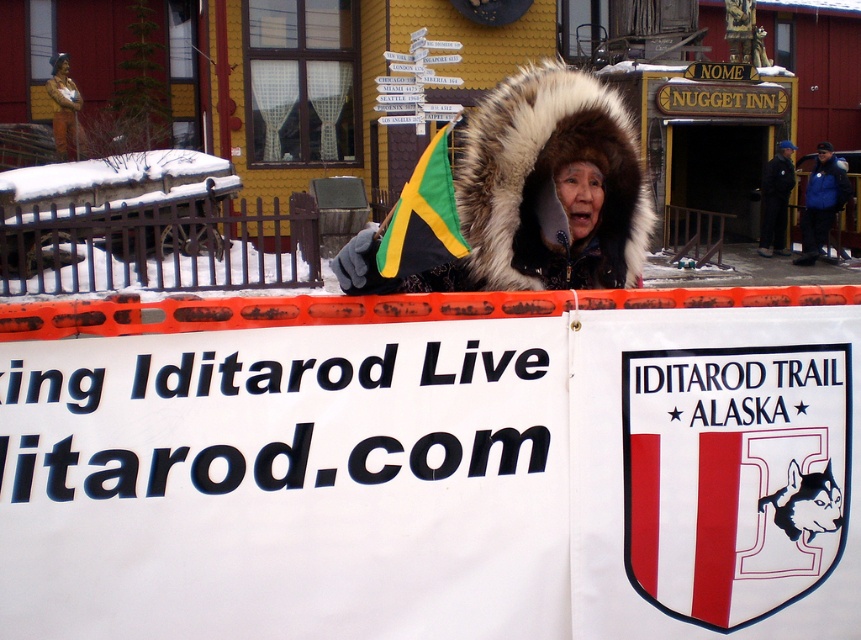
Question: Among these points, which one is farthest from the camera?

Choices:
 (A) (808, 234)
 (B) (515, 124)
 (C) (308, 372)

Answer: (A)

Question: Is white paper sign at center thinner than fuzzy white fur coat at center?

Choices:
 (A) yes
 (B) no

Answer: (A)

Question: Can you confirm if blue fleece jacket at upper right is bigger than black fabric jacket at upper right?

Choices:
 (A) no
 (B) yes

Answer: (B)

Question: Is white paper sign at center thinner than fuzzy white fur coat at center?

Choices:
 (A) yes
 (B) no

Answer: (A)

Question: Which of the following is the closest to the observer?

Choices:
 (A) blue fleece jacket at upper right
 (B) matte bronze statue at upper left

Answer: (A)

Question: Which point is farther from the camera taking this photo?

Choices:
 (A) (852, 193)
 (B) (589, 100)
 (C) (69, 140)
 (D) (481, 557)

Answer: (C)